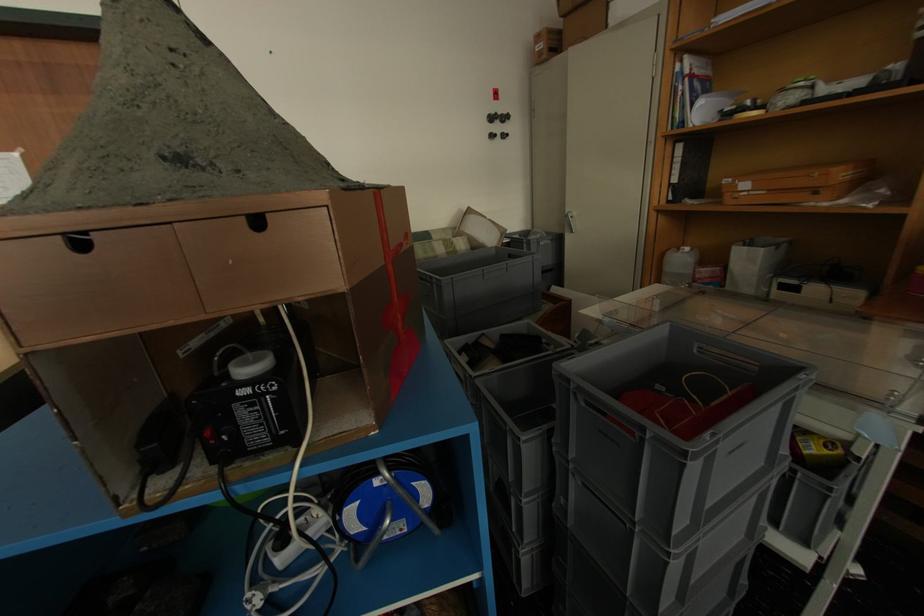
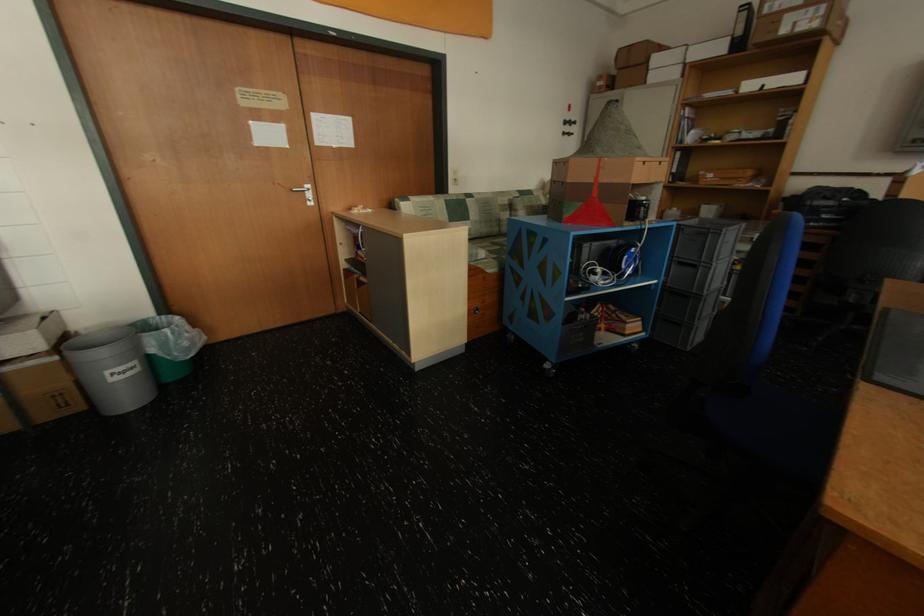
Find the pixel in the second image that matches (501,138) in the first image.

(573, 135)